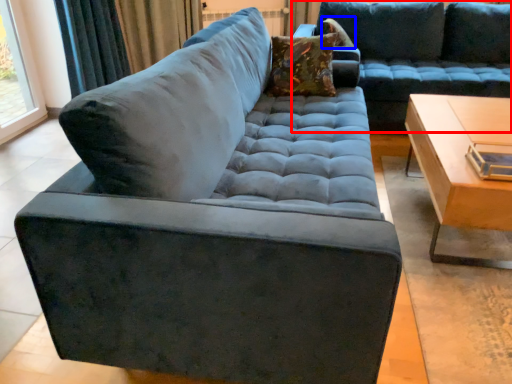
Question: Which object appears farthest to the camera in this image, studio couch (highlighted by a red box) or pillow (highlighted by a blue box)?

Choices:
 (A) studio couch
 (B) pillow

Answer: (B)